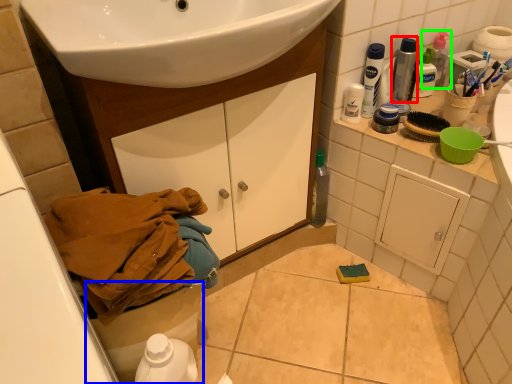
Question: Which object is the closest to the bottle (highlighted by a red box)? Choose among these: toilet bowl (highlighted by a blue box) or cleaning product (highlighted by a green box).

Choices:
 (A) toilet bowl
 (B) cleaning product

Answer: (B)